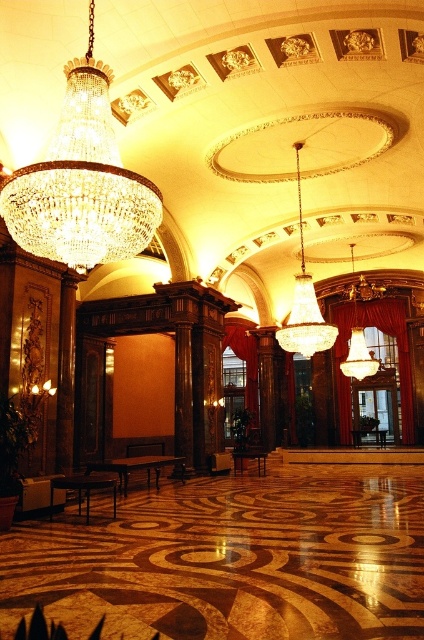
You are standing in the grand lobby and want to locate the crystal chandelier at center. According to the coordinates provided, where exactly is it positioned?

The crystal chandelier at center is located at coordinates point (304, 301).

You are standing in the grand lobby and want to walk directly towards the crystal chandelier at center. Considering the distance, will you need to walk more than 10 meters to reach it?

The distance between the crystal chandelier at center and the viewer is 13.04 meters, so yes, you will need to walk more than 10 meters to reach it.

Based on the photo, you are standing in the grand lobby and want to walk to the point marked at coordinates point (64, 163). If your walking speed is 3 feet per second, how many seconds will it take you to reach that point?

The distance between you and point (64, 163) is 21.84 feet. At a speed of 3 feet per second, it will take 21.84 divided by 3, which equals approximately 7.28 seconds to reach the point.